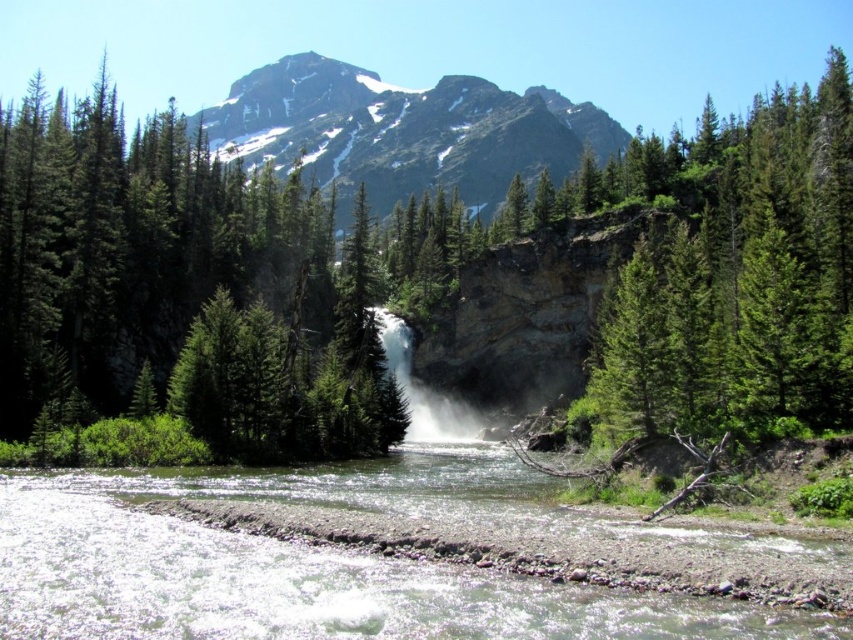
How much distance is there between clear water at center and snowy granite mountain at upper center?

835.30 feet

Which is more to the right, clear water at center or snowy granite mountain at upper center?

clear water at center is more to the right.

Between point (291, 480) and point (271, 154), which one is positioned behind?

Positioned behind is point (271, 154).

Where is `clear water at center`? clear water at center is located at coordinates click(x=338, y=561).